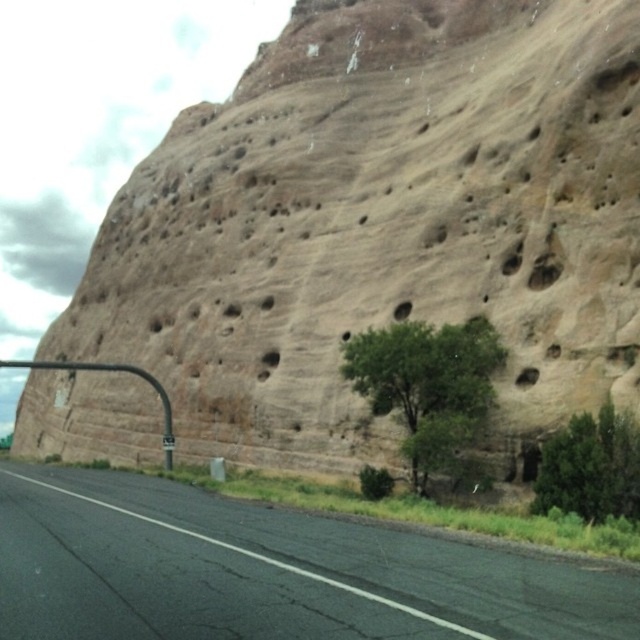
You are driving a car and see the black asphalt road at center and the green leafy tree at center. Which one is lower from the ground level?

The black asphalt road at center is located below the green leafy tree at center, so the road is lower from the ground level.

You are a hiker standing at the edge of the black asphalt road at center. You want to take a photo of the green leafy tree at center. Which object should you focus on first to ensure both are in frame?

The black asphalt road at center is bigger than the green leafy tree at center, so you should focus on the black asphalt road at center first to ensure both are in frame.

You are standing on the road and looking towards the cliff. There are two points marked on the road, one at point coordinates point (429, 332) and the other at point (586, 518). Which point is closer to you?

Point (429, 332) is further to the camera than point (586, 518), so the point closer to you is point (586, 518).